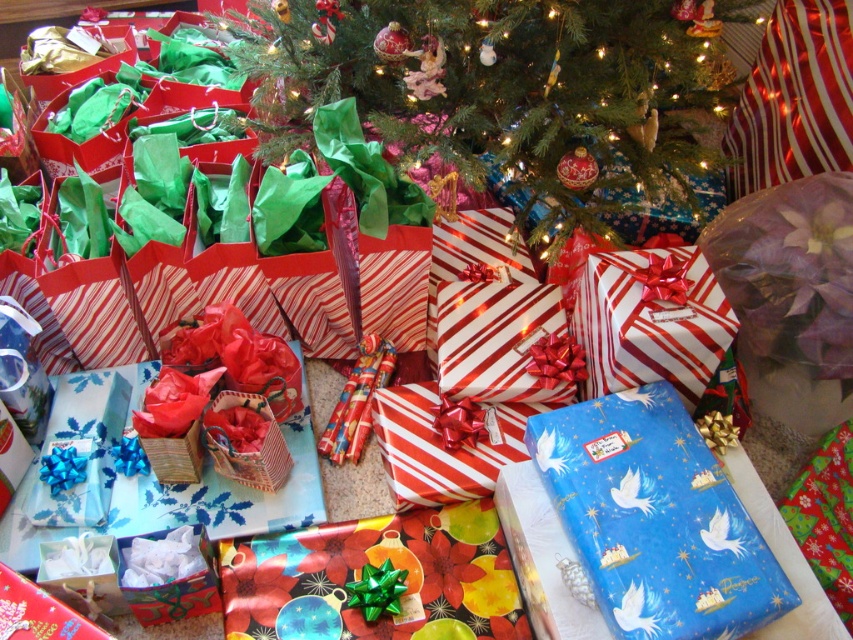
You are a gift organizer at a store and need to place the green paper christmas tree at center and the white striped paper gift at center onto a shelf. The shelf has a width of 1.2 meters. Can both items fit side by side on the shelf without overlapping?

The green paper christmas tree at center might be wider than white striped paper gift at center, but since the shelf is 1.2 meters wide, it depends on their exact widths. Without knowing the exact widths of both items, we cannot definitively determine if they will fit side by side on the shelf.

You are a child who wants to choose the tallest gift to open first. You see the blue glossy gift at center and the white striped paper gift at center. Which one should you choose?

You should choose the blue glossy gift at center because it is much taller than the white striped paper gift at center.